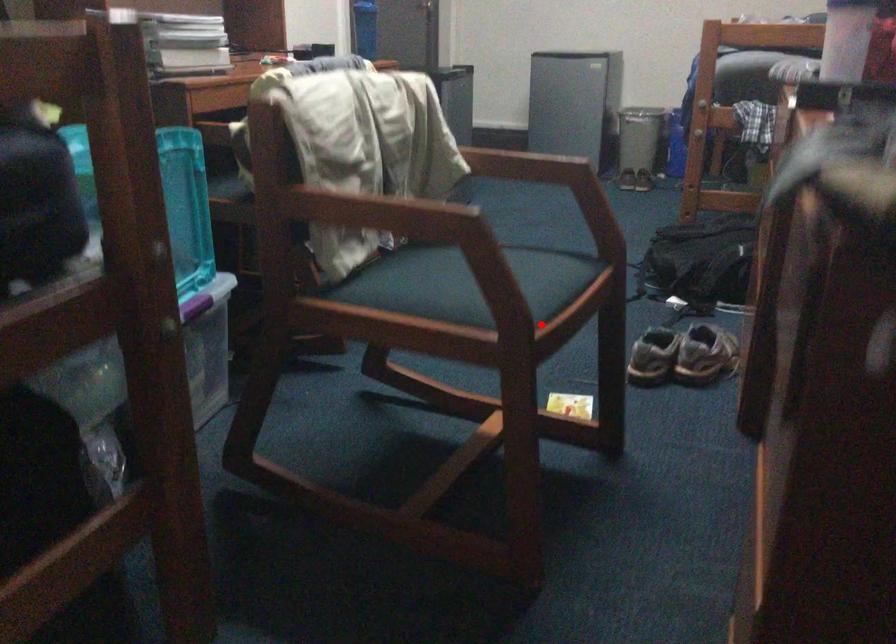
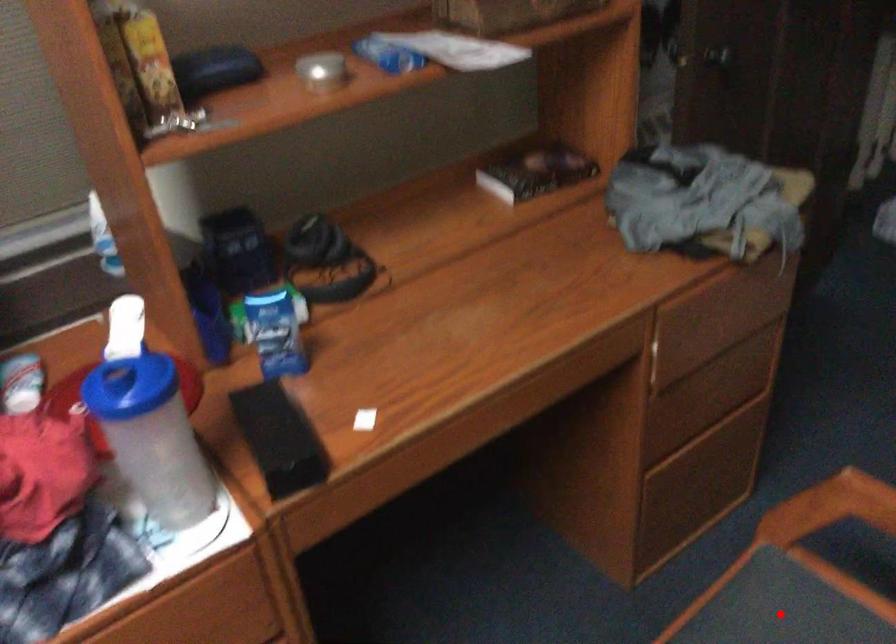
From the picture: I am providing you with two images of the same scene from different viewpoints. A red point is marked on the first image and another point is marked on the second image. Is the red point in image1 aligned with the point shown in image2?

Yes